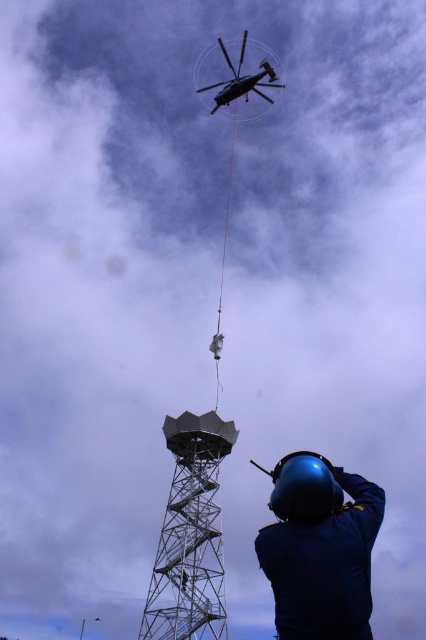
Question: Does blue hard hat at lower right appear over metallic gray tower at center?

Choices:
 (A) no
 (B) yes

Answer: (B)

Question: Which object is the closest to the metallic gray helicopter at upper center?

Choices:
 (A) blue hard hat at lower right
 (B) metallic gray tower at center

Answer: (B)

Question: Can you confirm if metallic gray tower at center is thinner than metallic gray helicopter at upper center?

Choices:
 (A) no
 (B) yes

Answer: (B)

Question: Which object appears farthest from the camera in this image?

Choices:
 (A) metallic gray tower at center
 (B) blue hard hat at lower right

Answer: (A)

Question: Can you confirm if metallic gray tower at center is positioned above metallic gray helicopter at upper center?

Choices:
 (A) no
 (B) yes

Answer: (A)

Question: Which of the following is the closest to the observer?

Choices:
 (A) (212, 513)
 (B) (261, 64)
 (C) (276, 483)

Answer: (C)